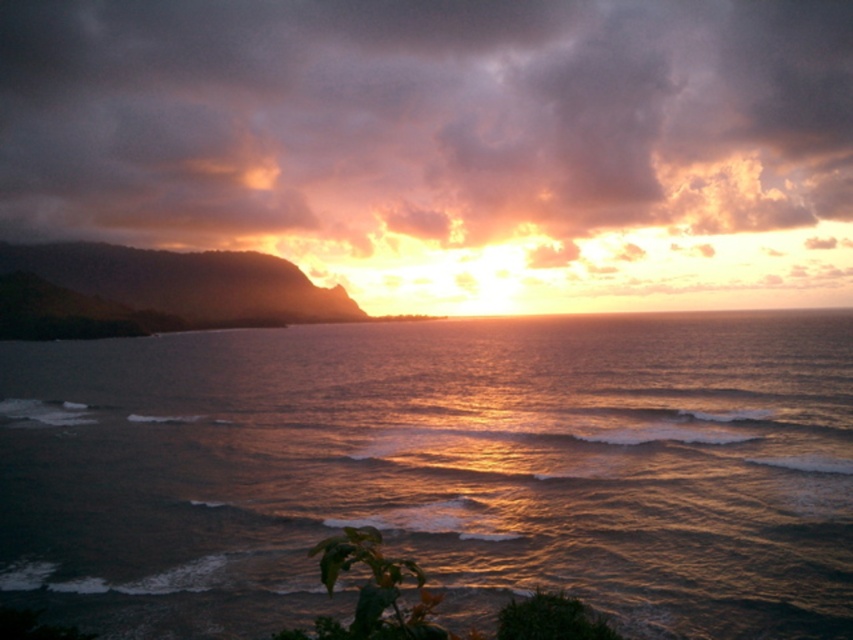
Question: Among these objects, which one is nearest to the camera?

Choices:
 (A) shiny golden water at center
 (B) cloudy sky at upper center

Answer: (A)

Question: Is shiny golden water at center wider than cloudy sky at upper center?

Choices:
 (A) no
 (B) yes

Answer: (A)

Question: Is shiny golden water at center to the right of cloudy sky at upper center from the viewer's perspective?

Choices:
 (A) no
 (B) yes

Answer: (A)

Question: Does shiny golden water at center come behind cloudy sky at upper center?

Choices:
 (A) yes
 (B) no

Answer: (B)

Question: Which point is farther from the camera taking this photo?

Choices:
 (A) pos(756,480)
 (B) pos(94,81)

Answer: (B)